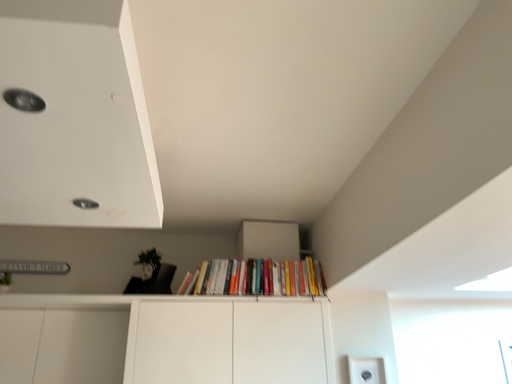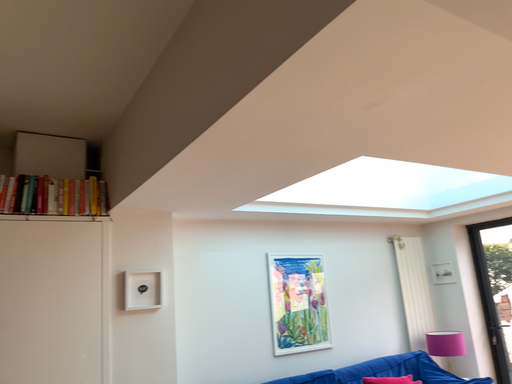
Question: Which way did the camera rotate in the video?

Choices:
 (A) rotated upward
 (B) rotated downward

Answer: (B)